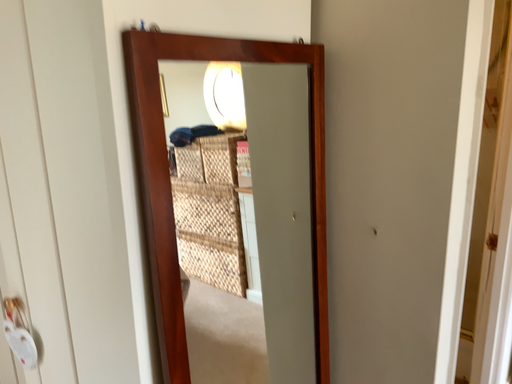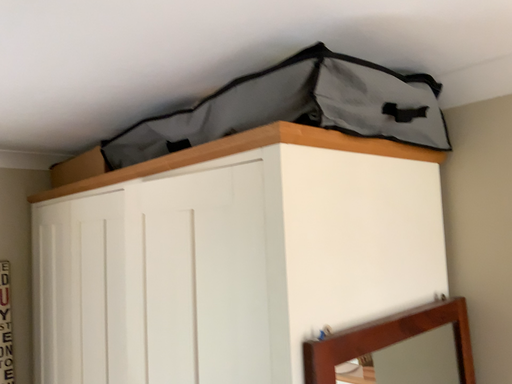
Question: How did the camera likely rotate when shooting the video?

Choices:
 (A) rotated downward
 (B) rotated upward

Answer: (B)